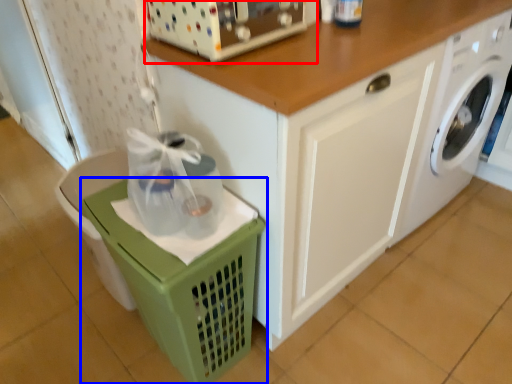
Question: Among these objects, which one is nearest to the camera, appliance (highlighted by a red box) or basket (highlighted by a blue box)?

Choices:
 (A) appliance
 (B) basket

Answer: (A)